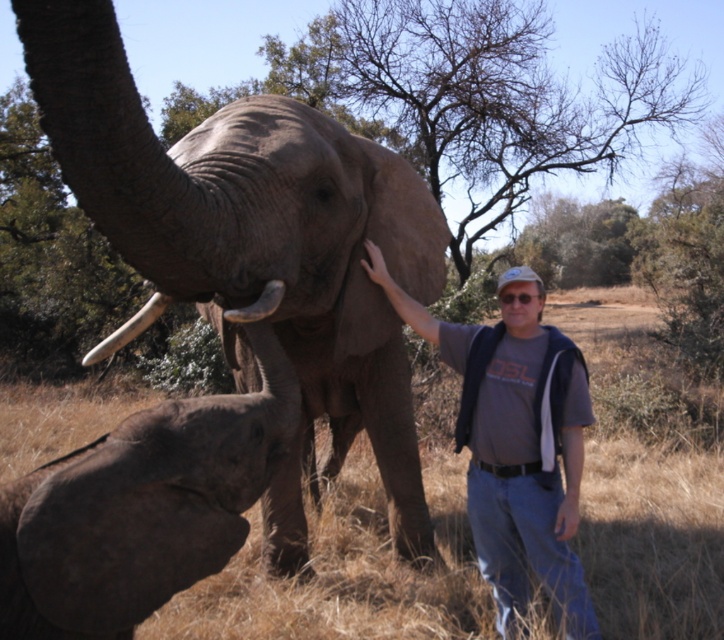
Between gray fabric shirt at center and white ivory tusk at upper left, which one is positioned higher?

Positioned higher is white ivory tusk at upper left.

Does gray fabric shirt at center come in front of white ivory tusk at upper left?

No, gray fabric shirt at center is behind white ivory tusk at upper left.

Is point (481, 563) closer to viewer compared to point (161, 310)?

No, (481, 563) is behind (161, 310).

Locate an element on the screen. Image resolution: width=724 pixels, height=640 pixels. gray fabric shirt at center is located at coordinates (513, 445).

Can you confirm if gray matte elephant at lower left is positioned below gray fabric shirt at center?

Actually, gray matte elephant at lower left is above gray fabric shirt at center.

Does gray matte elephant at lower left have a larger size compared to gray fabric shirt at center?

Actually, gray matte elephant at lower left might be smaller than gray fabric shirt at center.

Is point (122, 502) in front of point (476, 525)?

Yes, it is.

This screenshot has width=724, height=640. I want to click on gray matte elephant at lower left, so click(140, 508).

Describe the element at coordinates (140, 508) in the screenshot. The height and width of the screenshot is (640, 724). I see `gray matte elephant at lower left` at that location.

Can you confirm if gray matte elephant at lower left is positioned to the left of white ivory tusk at upper left?

Incorrect, gray matte elephant at lower left is not on the left side of white ivory tusk at upper left.

This screenshot has width=724, height=640. What do you see at coordinates (140, 508) in the screenshot?
I see `gray matte elephant at lower left` at bounding box center [140, 508].

I want to click on gray matte elephant at lower left, so click(140, 508).